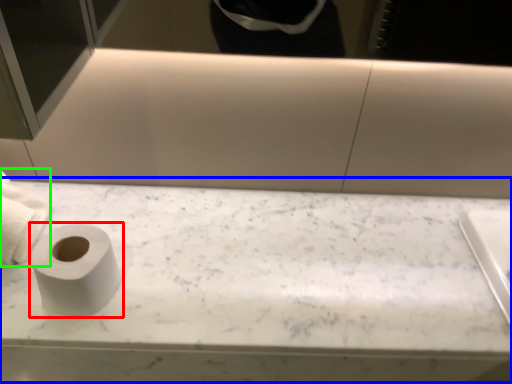
Question: Estimate the real-world distances between objects in this image. Which object is farther from toilet paper (highlighted by a red box), counter top (highlighted by a blue box) or toilet paper (highlighted by a green box)?

Choices:
 (A) counter top
 (B) toilet paper

Answer: (A)